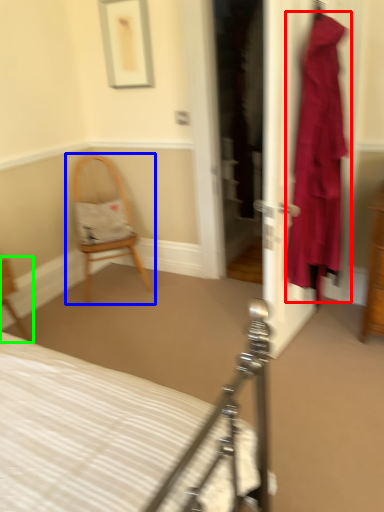
Question: Based on their relative distances, which object is nearer to clothing (highlighted by a red box)? Choose from chair (highlighted by a blue box) and chair (highlighted by a green box).

Choices:
 (A) chair
 (B) chair

Answer: (A)